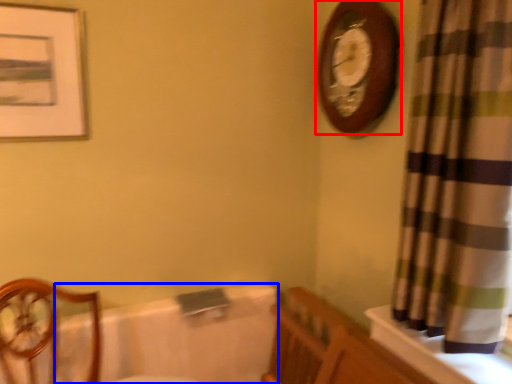
Question: Which of the following is the closest to the observer, wall clock (highlighted by a red box) or bath (highlighted by a blue box)?

Choices:
 (A) wall clock
 (B) bath

Answer: (A)